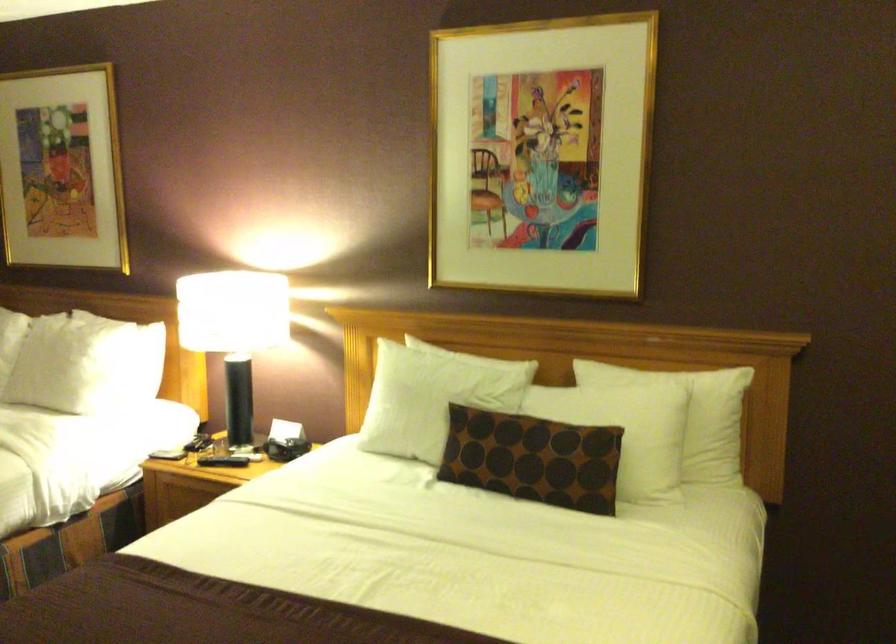
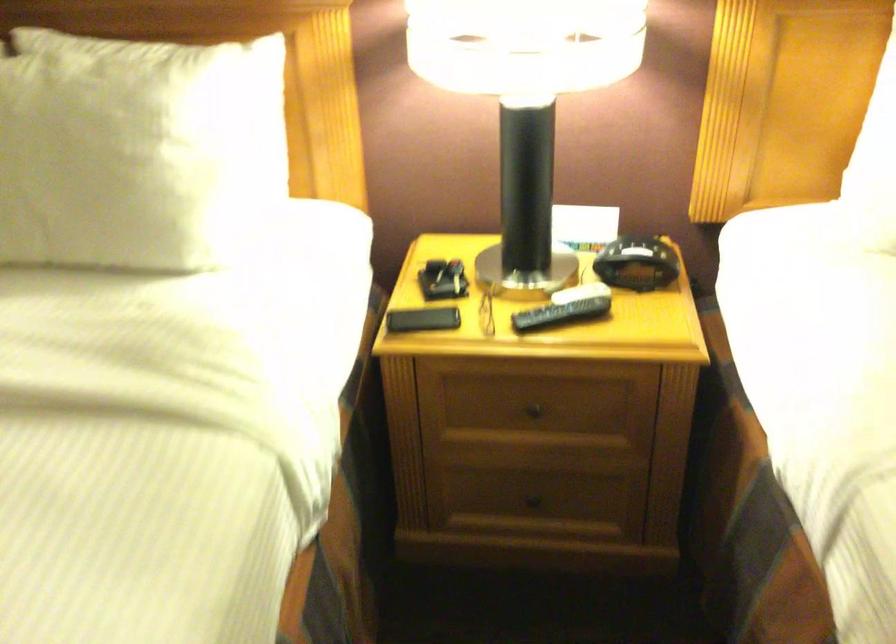
The point at (72, 355) is marked in the first image. Where is the corresponding point in the second image?

(134, 149)